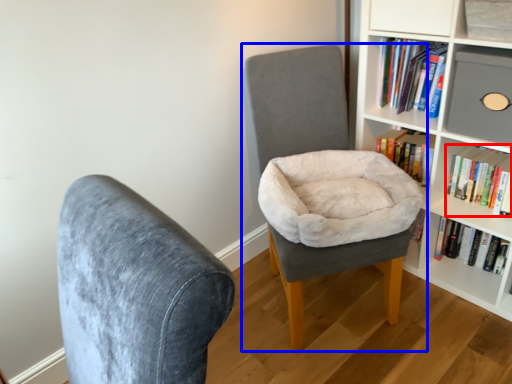
Question: Which point is closer to the camera, book (highlighted by a red box) or chair (highlighted by a blue box)?

Choices:
 (A) book
 (B) chair

Answer: (B)